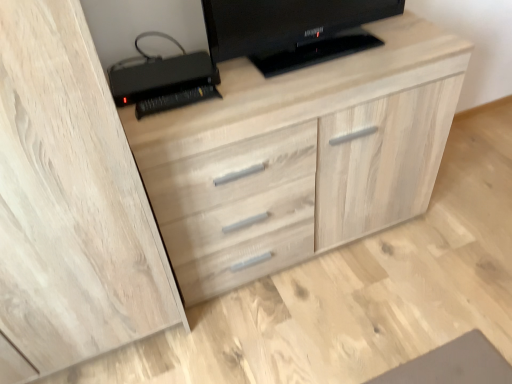
At what (x,y) coordinates should I click in order to perform the action: click on unoccupied region to the right of light wood dresser at center. Please return your answer as a coordinate pair (x, y). The width and height of the screenshot is (512, 384). Looking at the image, I should click on (448, 236).